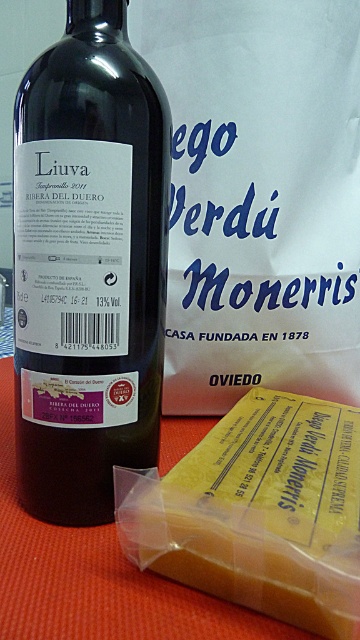
What is the color of the object located at point (258, 195)?

The point at (258, 195) indicates white paper at upper center, so the color is white.

You are standing in front of a table with a bottle of wine and a block of cheese. There are two points marked on the table surface at coordinates point [239,289] and point [228,532]. If you want to place a small vase between these two points so it is closer to you than the cheese, where should you position it?

The point [239,289] is closer to the viewer than point [228,532]. To place the vase closer to you than the cheese, position it near point [239,289].